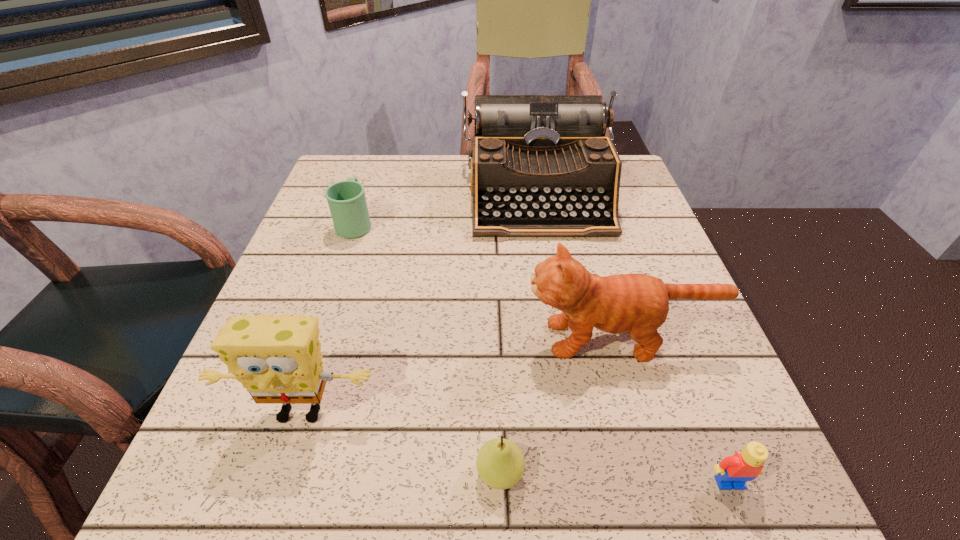
Image resolution: width=960 pixels, height=540 pixels. In order to click on cat at the right edge in this screenshot , I will do `click(637, 303)`.

Where is `Lego present at the right edge`? Image resolution: width=960 pixels, height=540 pixels. Lego present at the right edge is located at coordinates (734, 471).

Find the location of a particular element. Image resolution: width=960 pixels, height=540 pixels. object that is at the far right corner is located at coordinates (541, 166).

The image size is (960, 540). Identify the location of object present at the near right corner. (734, 471).

At what (x,y) coordinates should I click in order to perform the action: click on free space at the far edge of the desktop. Please return your answer as a coordinate pair (x, y). This screenshot has width=960, height=540. Looking at the image, I should click on pyautogui.click(x=463, y=200).

The width and height of the screenshot is (960, 540). Find the location of `free region at the near edge of the desktop`. free region at the near edge of the desktop is located at coordinates tap(394, 477).

The image size is (960, 540). I want to click on vacant space at the left edge of the desktop, so click(349, 290).

Where is `vacant space at the right edge of the desktop`? The width and height of the screenshot is (960, 540). vacant space at the right edge of the desktop is located at coordinates (737, 402).

I want to click on vacant area at the far left corner, so coord(367,179).

In the image, there is a desktop. Find the location of `free space at the near left corner`. free space at the near left corner is located at coordinates (197, 490).